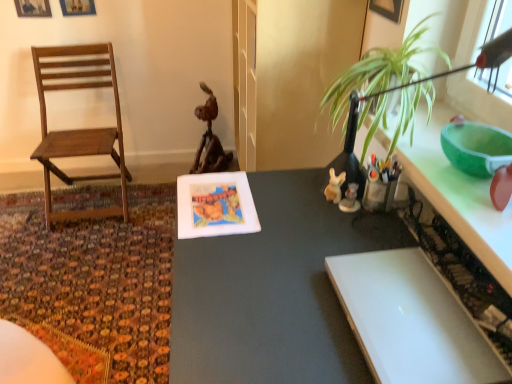
Find the location of a particular element. vacant area located to the right-hand side of white matte rabbit at center-right, which is the first toy from left to right is located at coordinates (381, 214).